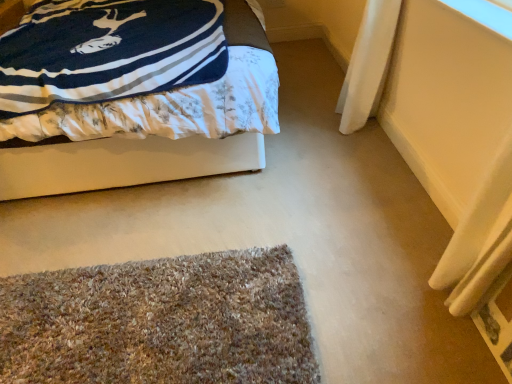
Find the location of a particular element. velvet-like blue blanket at upper left is located at coordinates (164, 133).

Identify the location of multicolored shaggy mat at lower center. The width and height of the screenshot is (512, 384). (160, 322).

I want to click on transparent plastic window screen at upper right, so click(x=485, y=14).

In terms of size, does multicolored shaggy mat at lower center appear bigger or smaller than transparent plastic window screen at upper right?

In the image, multicolored shaggy mat at lower center appears to be larger than transparent plastic window screen at upper right.

Is transparent plastic window screen at upper right a part of multicolored shaggy mat at lower center?

No, transparent plastic window screen at upper right is not surrounded by multicolored shaggy mat at lower center.

From a real-world perspective, is multicolored shaggy mat at lower center physically above transparent plastic window screen at upper right?

Incorrect, from a real-world perspective, multicolored shaggy mat at lower center is lower than transparent plastic window screen at upper right.

Does multicolored shaggy mat at lower center turn towards transparent plastic window screen at upper right?

No, multicolored shaggy mat at lower center is not turned towards transparent plastic window screen at upper right.

Considering the sizes of objects transparent plastic window screen at upper right and velvet-like blue blanket at upper left in the image provided, who is thinner, transparent plastic window screen at upper right or velvet-like blue blanket at upper left?

Thinner between the two is transparent plastic window screen at upper right.

Is transparent plastic window screen at upper right oriented towards velvet-like blue blanket at upper left?

No, transparent plastic window screen at upper right is not aimed at velvet-like blue blanket at upper left.

From a real-world perspective, who is located lower, transparent plastic window screen at upper right or velvet-like blue blanket at upper left?

In real-world perspective, velvet-like blue blanket at upper left is lower.

Does transparent plastic window screen at upper right contain velvet-like blue blanket at upper left?

Definitely not — velvet-like blue blanket at upper left is not inside transparent plastic window screen at upper right.

Is velvet-like blue blanket at upper left touching transparent plastic window screen at upper right?

No.

Between velvet-like blue blanket at upper left and transparent plastic window screen at upper right, which one appears on the right side from the viewer's perspective?

From the viewer's perspective, transparent plastic window screen at upper right appears more on the right side.

Is velvet-like blue blanket at upper left in front of or behind transparent plastic window screen at upper right in the image?

velvet-like blue blanket at upper left is positioned farther from the viewer than transparent plastic window screen at upper right.

Is velvet-like blue blanket at upper left completely or partially outside of transparent plastic window screen at upper right?

Yes.

From the image's perspective, who appears lower, transparent plastic window screen at upper right or multicolored shaggy mat at lower center?

multicolored shaggy mat at lower center is shown below in the image.

Is transparent plastic window screen at upper right closer to the viewer compared to multicolored shaggy mat at lower center?

No, transparent plastic window screen at upper right is behind multicolored shaggy mat at lower center.

Find the location of `bed that appears behind the multicolored shaggy mat at lower center`. bed that appears behind the multicolored shaggy mat at lower center is located at coordinates (164, 133).

Consider the image. From the image's perspective, is velvet-like blue blanket at upper left above multicolored shaggy mat at lower center?

Indeed, from the image's perspective, velvet-like blue blanket at upper left is shown above multicolored shaggy mat at lower center.

Is velvet-like blue blanket at upper left oriented away from multicolored shaggy mat at lower center?

No.

From a real-world perspective, between velvet-like blue blanket at upper left and multicolored shaggy mat at lower center, who is vertically lower?

multicolored shaggy mat at lower center is physically lower.

Looking at their sizes, would you say multicolored shaggy mat at lower center is wider or thinner than velvet-like blue blanket at upper left?

In the image, multicolored shaggy mat at lower center appears to be more narrow than velvet-like blue blanket at upper left.

Is multicolored shaggy mat at lower center taller or shorter than velvet-like blue blanket at upper left?

Considering their sizes, multicolored shaggy mat at lower center has less height than velvet-like blue blanket at upper left.

Where is `window screen on the right of multicolored shaggy mat at lower center`? window screen on the right of multicolored shaggy mat at lower center is located at coordinates coord(485,14).

Identify the location of bed located on the left of transparent plastic window screen at upper right. (164, 133).

Considering their positions, is multicolored shaggy mat at lower center positioned closer to transparent plastic window screen at upper right than velvet-like blue blanket at upper left?

Based on the image, velvet-like blue blanket at upper left appears to be nearer to transparent plastic window screen at upper right.

Looking at the image, which one is located further to multicolored shaggy mat at lower center, velvet-like blue blanket at upper left or transparent plastic window screen at upper right?

Among the two, transparent plastic window screen at upper right is located further to multicolored shaggy mat at lower center.

Based on their spatial positions, is velvet-like blue blanket at upper left or multicolored shaggy mat at lower center further from transparent plastic window screen at upper right?

Based on the image, multicolored shaggy mat at lower center appears to be further to transparent plastic window screen at upper right.

Estimate the real-world distances between objects in this image. Which object is further from velvet-like blue blanket at upper left, multicolored shaggy mat at lower center or transparent plastic window screen at upper right?

transparent plastic window screen at upper right.

From the image, which object appears to be nearer to velvet-like blue blanket at upper left, transparent plastic window screen at upper right or multicolored shaggy mat at lower center?

multicolored shaggy mat at lower center is positioned closer to the anchor velvet-like blue blanket at upper left.

Estimate the real-world distances between objects in this image. Which object is further from multicolored shaggy mat at lower center, transparent plastic window screen at upper right or velvet-like blue blanket at upper left?

transparent plastic window screen at upper right lies further to multicolored shaggy mat at lower center than the other object.

You are a GUI agent. You are given a task and a screenshot of the screen. Output one action in this format:
    pyautogui.click(x=<x>, y=<y>)
    Task: Click on the mat between velvet-like blue blanket at upper left and transparent plastic window screen at upper right from left to right
    
    Given the screenshot: What is the action you would take?
    pyautogui.click(x=160, y=322)